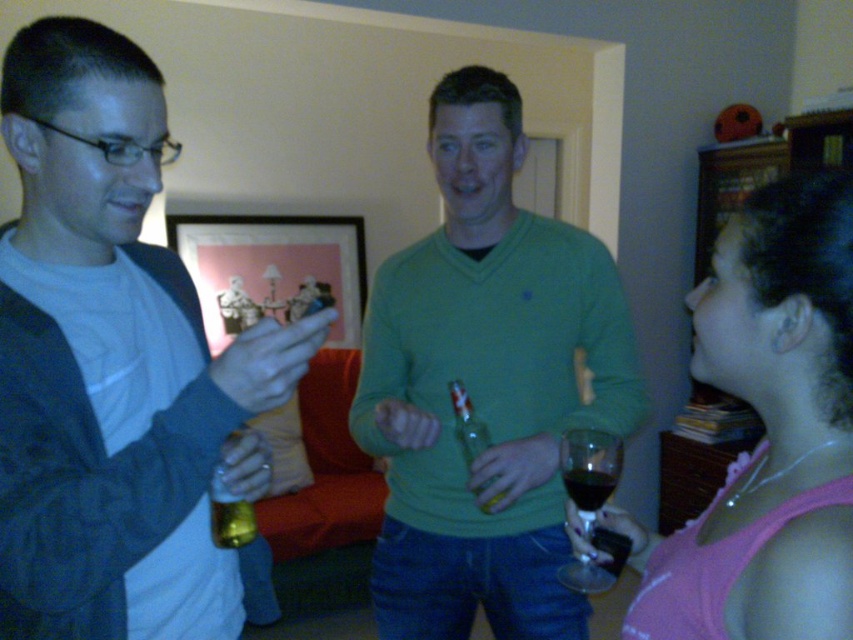
Between point (433, 374) and point (221, 541), which one is positioned behind?

The point (433, 374) is behind.

Measure the distance from green matte sweater at center to gold metallic can at center.

22.00 inches

I want to click on green matte sweater at center, so tap(485, 385).

The width and height of the screenshot is (853, 640). Describe the element at coordinates (113, 364) in the screenshot. I see `matte black jacket at left` at that location.

Based on the photo, does matte black jacket at left appear on the left side of gold metallic can at center?

Indeed, matte black jacket at left is positioned on the left side of gold metallic can at center.

Describe the element at coordinates (113, 364) in the screenshot. I see `matte black jacket at left` at that location.

The image size is (853, 640). Identify the location of matte black jacket at left. (113, 364).

Between translucent glass bottle at center and gold metallic can at center, which one is positioned lower?

gold metallic can at center is lower down.

Is translucent glass bottle at center in front of gold metallic can at center?

No, it is not.

What do you see at coordinates (467, 424) in the screenshot?
I see `translucent glass bottle at center` at bounding box center [467, 424].

Where is `translucent glass bottle at center`? This screenshot has height=640, width=853. translucent glass bottle at center is located at coordinates (467, 424).